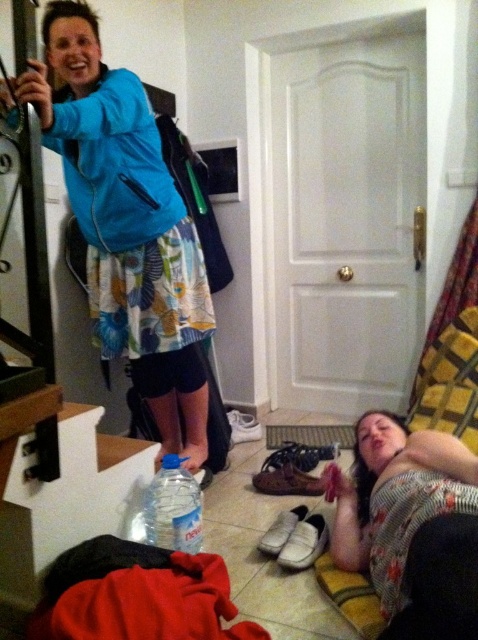
Question: Does blue matte jacket at upper left have a smaller size compared to clear plastic water bottle at lower center?

Choices:
 (A) yes
 (B) no

Answer: (B)

Question: Among these points, which one is farthest from the camera?

Choices:
 (A) (180, 464)
 (B) (443, 460)

Answer: (A)

Question: Where is floral fabric shirt at lower right located in relation to clear plastic water bottle at lower center in the image?

Choices:
 (A) right
 (B) left

Answer: (A)

Question: Which point is closer to the camera taking this photo?

Choices:
 (A) (x=165, y=493)
 (B) (x=45, y=52)
 (C) (x=368, y=570)

Answer: (C)

Question: From the image, what is the correct spatial relationship of blue matte jacket at upper left in relation to floral fabric shirt at lower right?

Choices:
 (A) below
 (B) above

Answer: (B)

Question: Which point is farther to the camera?

Choices:
 (A) (171, 538)
 (B) (202, 260)

Answer: (B)